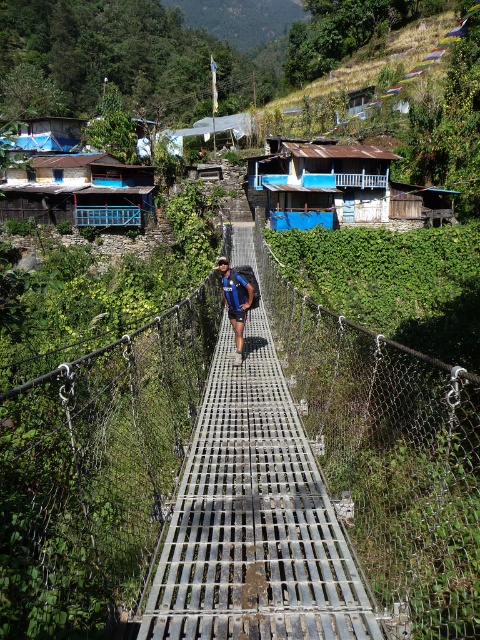
Where is `metal grating bridge at center`? metal grating bridge at center is located at coordinates (97, 472).

Is metal grating bridge at center thinner than rusty metal hut at center?

Yes, metal grating bridge at center is thinner than rusty metal hut at center.

Image resolution: width=480 pixels, height=640 pixels. I want to click on metal grating bridge at center, so click(97, 472).

The width and height of the screenshot is (480, 640). What do you see at coordinates (321, 182) in the screenshot?
I see `rusty metal hut at center` at bounding box center [321, 182].

Is point (267, 193) positioned after point (226, 280)?

Yes, point (267, 193) is farther from viewer.

Between point (262, 164) and point (224, 280), which one is positioned behind?

Positioned behind is point (262, 164).

Find the location of a particular element. rusty metal hut at center is located at coordinates (321, 182).

Does point (419, 404) come in front of point (235, 358)?

Yes.

Who is more distant from viewer, (126, 481) or (252, 291)?

The point (126, 481) is more distant.

Locate an element on the screen. This screenshot has width=480, height=640. metal grating bridge at center is located at coordinates (97, 472).